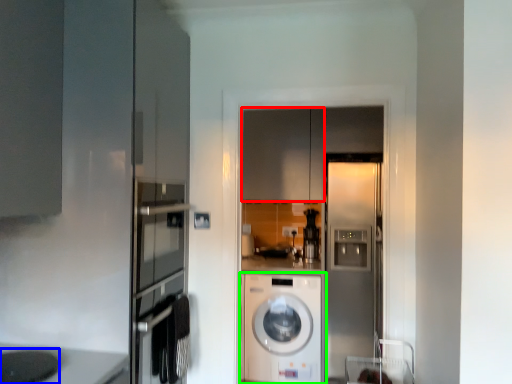
Question: Based on their relative distances, which object is farther from cabinetry (highlighted by a red box)? Choose from appliance (highlighted by a blue box) and washing machine (highlighted by a green box).

Choices:
 (A) appliance
 (B) washing machine

Answer: (A)